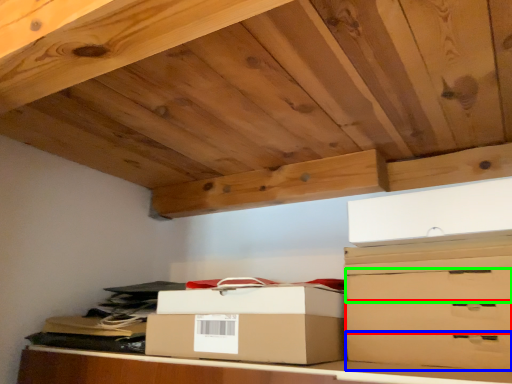
Question: Which object is the closest to the drawer (highlighted by a red box)? Choose among these: drawer (highlighted by a blue box) or drawer (highlighted by a green box).

Choices:
 (A) drawer
 (B) drawer

Answer: (A)